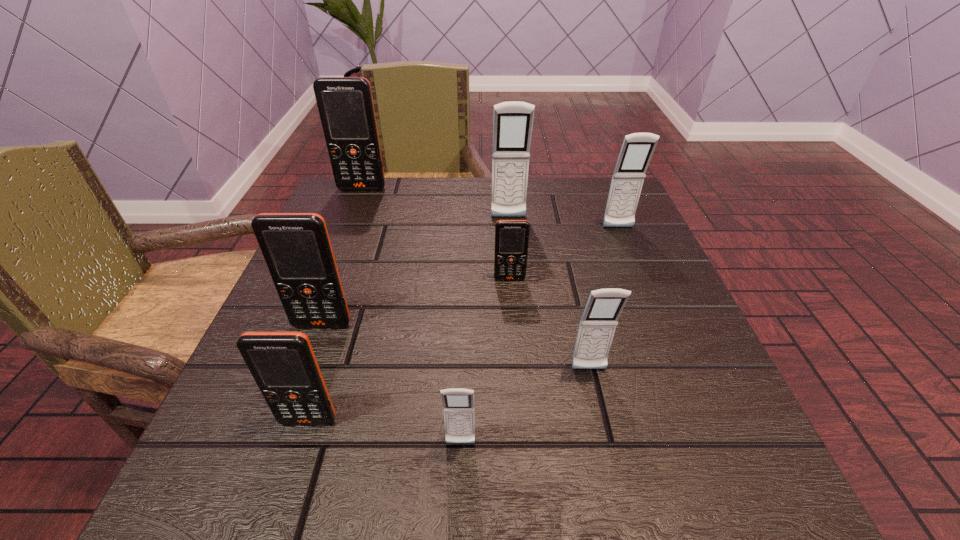
Where is `blank region between the fifth cellular telephone from right to left and the second smallest gray cellular telephone`? The width and height of the screenshot is (960, 540). blank region between the fifth cellular telephone from right to left and the second smallest gray cellular telephone is located at coordinates (525, 407).

You are a GUI agent. You are given a task and a screenshot of the screen. Output one action in this format:
    pyautogui.click(x=<x>, y=<y>)
    Task: Click on the vacant area that lies between the rightmost orange cellular telephone and the second nearest object
    Image resolution: width=960 pixels, height=540 pixels.
    Given the screenshot: What is the action you would take?
    pyautogui.click(x=409, y=350)

You are a GUI agent. You are given a task and a screenshot of the screen. Output one action in this format:
    pyautogui.click(x=<x>, y=<y>)
    Task: Click on the unoccupied position between the third smallest orange cellular telephone and the biggest gray cellular telephone
    
    Given the screenshot: What is the action you would take?
    pos(416,271)

Image resolution: width=960 pixels, height=540 pixels. Identify the location of object that is the third closest to the fifth object from right to left. (296, 247).

This screenshot has height=540, width=960. What are the coordinates of `object that can be found as the closest to the third nearest gray cellular telephone` in the screenshot? It's located at (512, 124).

Identify the location of cellular telephone that is the seventh closest to the third nearest object. The height and width of the screenshot is (540, 960). (345, 104).

Locate which cellular telephone ranks sixth in proximity to the farthest gray cellular telephone. Please provide its 2D coordinates. Your answer should be formatted as a tuple, i.e. [(x, y)], where the tuple contains the x and y coordinates of a point satisfying the conditions above.

[(458, 404)]

Identify which orange cellular telephone is the nearest to the second farthest cellular telephone. Please provide its 2D coordinates. Your answer should be formatted as a tuple, i.e. [(x, y)], where the tuple contains the x and y coordinates of a point satisfying the conditions above.

[(511, 236)]

This screenshot has height=540, width=960. In order to click on orange cellular telephone that is the second nearest to the nearest cellular telephone in this screenshot , I will do `click(296, 247)`.

Where is `the third closest gray cellular telephone to the biggest gray cellular telephone`? The width and height of the screenshot is (960, 540). the third closest gray cellular telephone to the biggest gray cellular telephone is located at coordinates (458, 404).